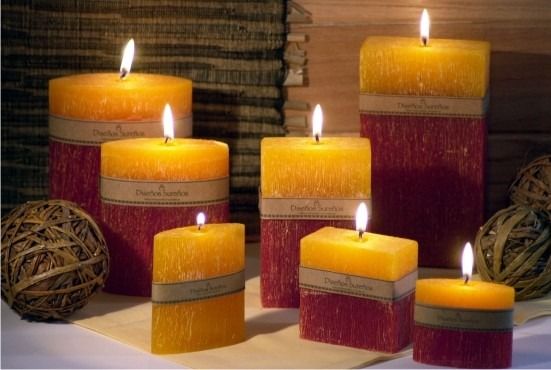
You are a GUI agent. You are given a task and a screenshot of the screen. Output one action in this format:
    pyautogui.click(x=<x>, y=<y>)
    Task: Click on the red and yellow candles
    
    Given the screenshot: What is the action you would take?
    pyautogui.click(x=77, y=135), pyautogui.click(x=128, y=191), pyautogui.click(x=270, y=208), pyautogui.click(x=326, y=277), pyautogui.click(x=440, y=316), pyautogui.click(x=396, y=103)